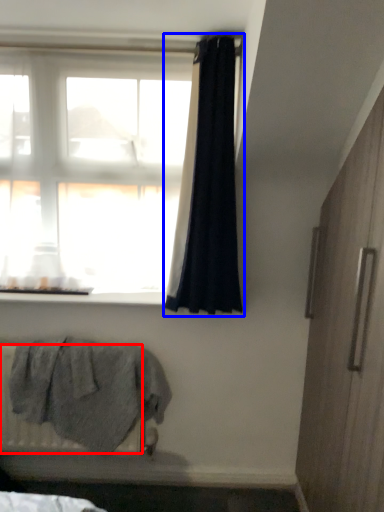
Question: Among these objects, which one is farthest to the camera, radiator (highlighted by a red box) or curtain (highlighted by a blue box)?

Choices:
 (A) radiator
 (B) curtain

Answer: (A)